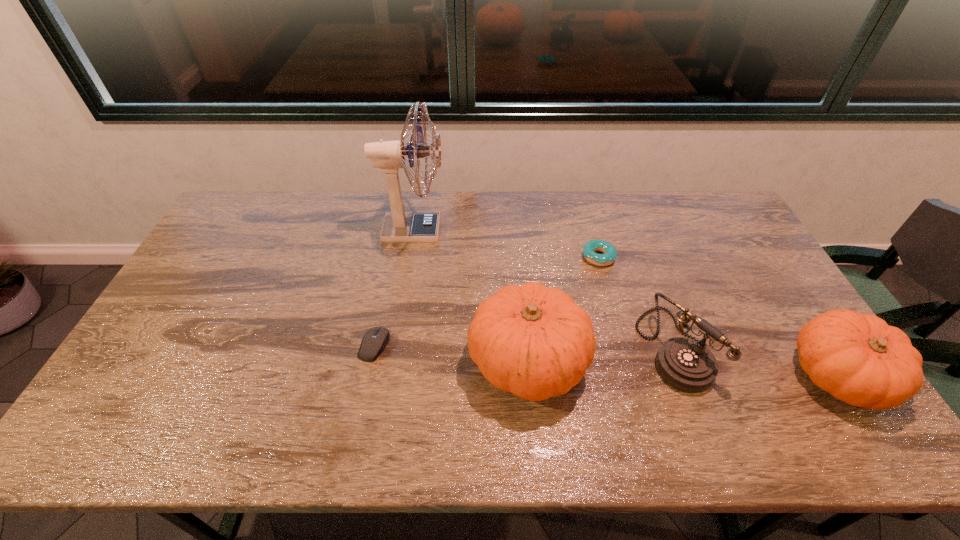
Please point a spot to add another pumpkin on the left. Please provide its 2D coordinates. Your answer should be formatted as a tuple, i.e. [(x, y)], where the tuple contains the x and y coordinates of a point satisfying the conditions above.

[(233, 347)]